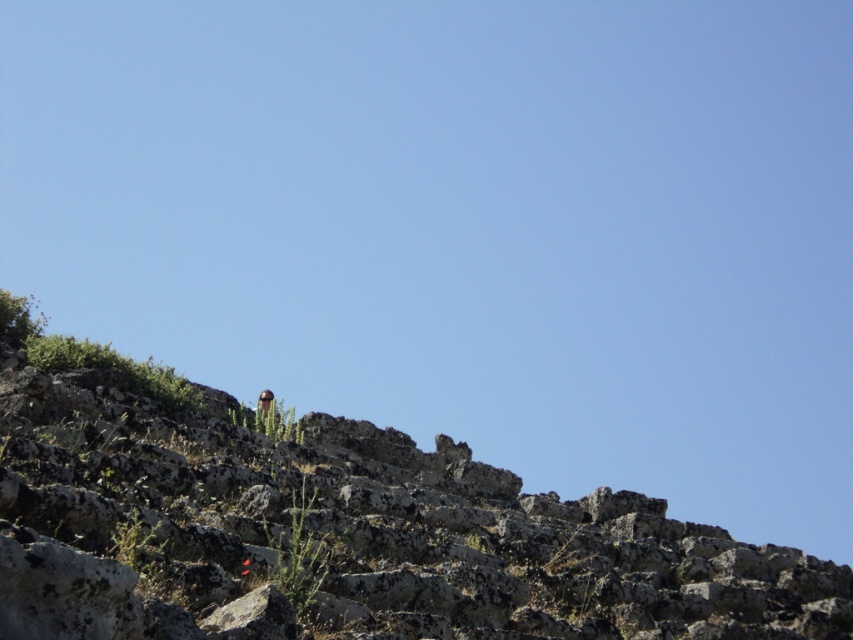
Question: Is rough stone hillside at upper center behind brown leather jacket at upper center?

Choices:
 (A) no
 (B) yes

Answer: (A)

Question: Among these objects, which one is nearest to the camera?

Choices:
 (A) rough stone hillside at upper center
 (B) brown leather jacket at upper center

Answer: (A)

Question: In this image, where is rough stone hillside at upper center located relative to brown leather jacket at upper center?

Choices:
 (A) below
 (B) above

Answer: (B)

Question: Does rough stone hillside at upper center lie in front of brown leather jacket at upper center?

Choices:
 (A) no
 (B) yes

Answer: (B)